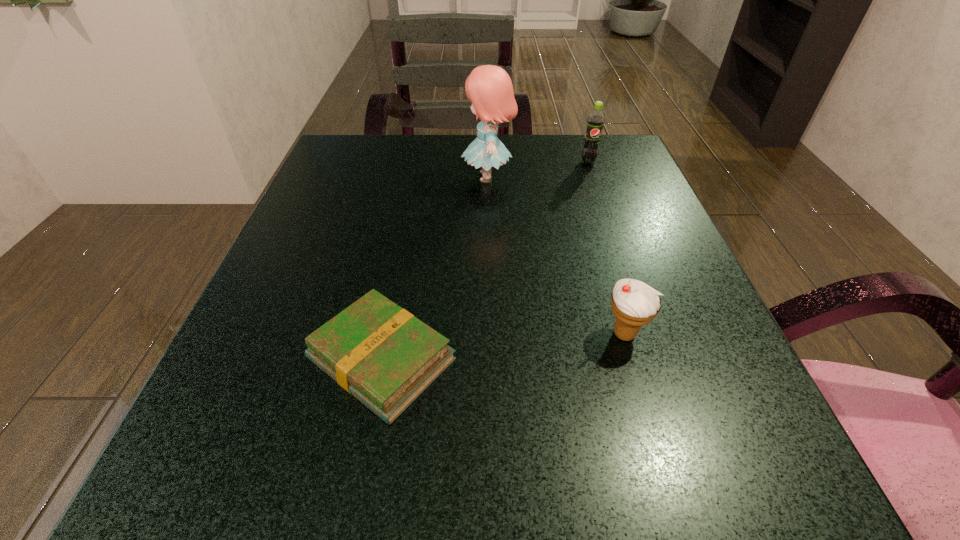
Where is `doll at the far edge`? doll at the far edge is located at coordinates (489, 88).

Locate an element on the screen. soda that is at the far edge is located at coordinates (595, 121).

I want to click on object present at the left edge, so click(383, 355).

Identify the location of soda located in the right edge section of the desktop. (595, 121).

The image size is (960, 540). In order to click on icecream present at the right edge in this screenshot , I will do (x=634, y=303).

Identify the location of object at the far right corner. 595,121.

Locate an element on the screen. Image resolution: width=960 pixels, height=540 pixels. free space at the far edge of the desktop is located at coordinates (567, 185).

Identify the location of free space at the near edge of the desktop. The width and height of the screenshot is (960, 540). (416, 503).

The width and height of the screenshot is (960, 540). In order to click on vacant space at the left edge of the desktop in this screenshot , I will do `click(247, 328)`.

The image size is (960, 540). In the image, there is a desktop. Find the location of `vacant space at the right edge`. vacant space at the right edge is located at coordinates (668, 245).